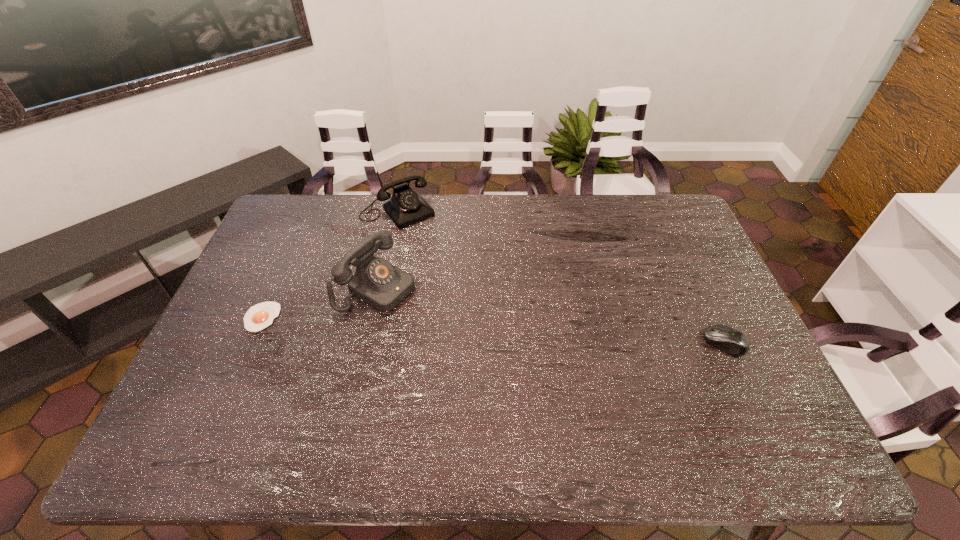
Locate an element on the screen. Image resolution: width=960 pixels, height=540 pixels. the shortest object is located at coordinates (259, 316).

The image size is (960, 540). Identify the location of egg yolk. (259, 316).

The width and height of the screenshot is (960, 540). In order to click on mouse in this screenshot , I will do tap(727, 339).

Where is `the second shortest object`? The height and width of the screenshot is (540, 960). the second shortest object is located at coordinates (727, 339).

You are a GUI agent. You are given a task and a screenshot of the screen. Output one action in this format:
    pyautogui.click(x=<x>, y=<y>)
    Task: Click on the nearer telephone
    
    Given the screenshot: What is the action you would take?
    pyautogui.click(x=382, y=285)

The image size is (960, 540). In order to click on the taller telephone in this screenshot , I will do `click(382, 285)`.

Identify the location of the farthest object. (406, 207).

Locate an element on the screen. Image resolution: width=960 pixels, height=540 pixels. the shorter telephone is located at coordinates (406, 207).

At what (x,y) coordinates should I click in order to perform the action: click on vacant space situated on the right of the shortest object. Please return your answer as a coordinate pair (x, y). The height and width of the screenshot is (540, 960). Looking at the image, I should click on (382, 317).

Find the location of a particular element. Image resolution: width=960 pixels, height=540 pixels. free space located 0.220m on the left of the mouse is located at coordinates pos(625,343).